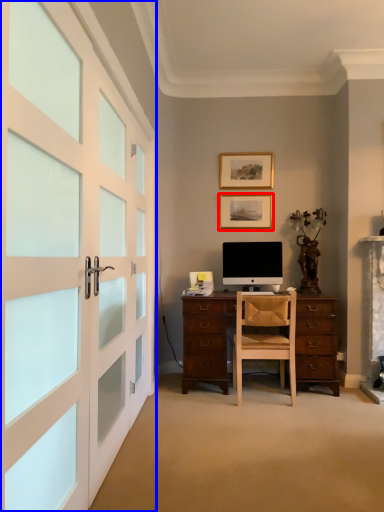
Question: Which object is closer to the camera taking this photo, picture frame (highlighted by a red box) or garage door (highlighted by a blue box)?

Choices:
 (A) picture frame
 (B) garage door

Answer: (B)